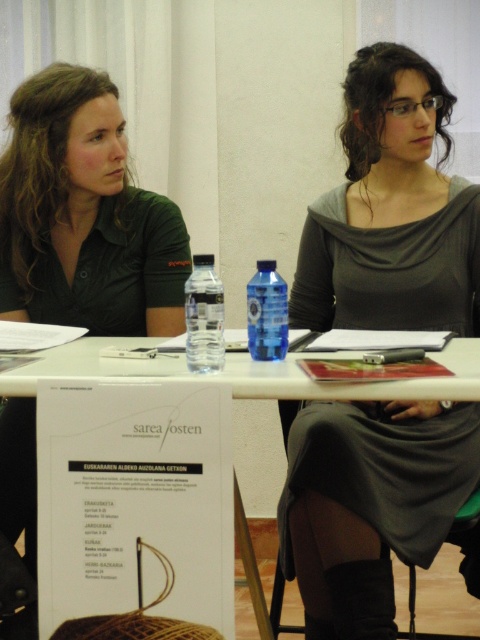
Can you confirm if matte green polo shirt at left is smaller than transparent plastic bottle at center?

No.

Does matte green polo shirt at left appear under transparent plastic bottle at center?

No.

Between point (80, 252) and point (195, 301), which one is positioned behind?

The point (80, 252) is more distant.

This screenshot has width=480, height=640. I want to click on matte green polo shirt at left, so click(x=84, y=216).

Can you confirm if matte green polo shirt at left is positioned below white paper at center?

No, matte green polo shirt at left is not below white paper at center.

Can you confirm if matte green polo shirt at left is positioned above white paper at center?

Correct, matte green polo shirt at left is located above white paper at center.

Which is in front, point (158, 314) or point (402, 388)?

Point (402, 388)

Locate an element on the screen. matte green polo shirt at left is located at coordinates (84, 216).

Can you confirm if white paper at center is positioned above blue plastic bottle at center?

Incorrect, white paper at center is not positioned above blue plastic bottle at center.

Is white paper at center positioned before blue plastic bottle at center?

Yes, it is.

What do you see at coordinates (355, 385) in the screenshot? I see `white paper at center` at bounding box center [355, 385].

Identify the location of white paper at center. (355, 385).